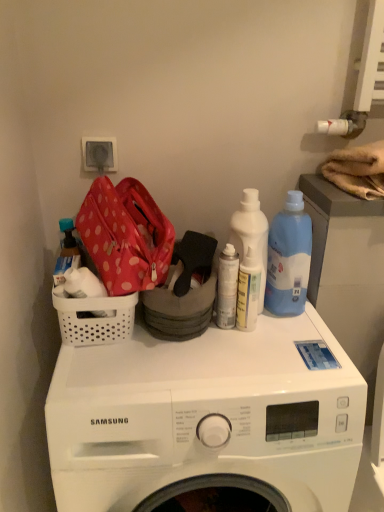
Question: Would you say translucent plastic bottle at left, the second bottle when ordered from right to left, is outside translucent plastic spray bottle at center, which is counted as the 1th cleaning product, starting from the left?

Choices:
 (A) no
 (B) yes

Answer: (B)

Question: Is translucent plastic spray bottle at center, which is counted as the 1th cleaning product, starting from the left, inside translucent plastic bottle at left, the second bottle when ordered from right to left?

Choices:
 (A) no
 (B) yes

Answer: (A)

Question: Is translucent plastic bottle at left, the second bottle when ordered from right to left, positioned far away from translucent plastic spray bottle at center, which is counted as the 1th cleaning product, starting from the left?

Choices:
 (A) no
 (B) yes

Answer: (A)

Question: Is translucent plastic bottle at left, the second bottle when ordered from right to left, positioned in front of translucent plastic spray bottle at center, which is counted as the third cleaning product, starting from the right?

Choices:
 (A) yes
 (B) no

Answer: (B)

Question: Considering the relative sizes of translucent plastic bottle at left, the 1th bottle positioned from the left, and translucent plastic spray bottle at center, which is counted as the 1th cleaning product, starting from the left, in the image provided, is translucent plastic bottle at left, the 1th bottle positioned from the left, bigger than translucent plastic spray bottle at center, which is counted as the 1th cleaning product, starting from the left,?

Choices:
 (A) no
 (B) yes

Answer: (B)

Question: Is white plastic electric outlet at upper left in front of or behind white plastic basket at left in the image?

Choices:
 (A) front
 (B) behind

Answer: (B)

Question: Considering the positions of white plastic electric outlet at upper left and white plastic basket at left in the image, is white plastic electric outlet at upper left taller or shorter than white plastic basket at left?

Choices:
 (A) tall
 (B) short

Answer: (B)

Question: From the image's perspective, is white plastic electric outlet at upper left above or below white plastic basket at left?

Choices:
 (A) above
 (B) below

Answer: (A)

Question: Do you think white plastic electric outlet at upper left is within white plastic basket at left, or outside of it?

Choices:
 (A) inside
 (B) outside

Answer: (B)

Question: From a real-world perspective, is blue plastic bottle at upper right, acting as the 1th cleaning product starting from the right, above or below white plastic electric outlet at upper left?

Choices:
 (A) above
 (B) below

Answer: (B)

Question: Considering their positions, is blue plastic bottle at upper right, acting as the 1th cleaning product starting from the right, located in front of or behind white plastic electric outlet at upper left?

Choices:
 (A) behind
 (B) front

Answer: (B)

Question: Is blue plastic bottle at upper right, acting as the 1th cleaning product starting from the right, inside the boundaries of white plastic electric outlet at upper left, or outside?

Choices:
 (A) outside
 (B) inside

Answer: (A)

Question: Is blue plastic bottle at upper right, which appears as the 3th cleaning product when viewed from the left, to the left or to the right of white plastic electric outlet at upper left in the image?

Choices:
 (A) right
 (B) left

Answer: (A)

Question: From a real-world perspective, is translucent plastic bottle at left, the second bottle when ordered from right to left, positioned above or below white matte spray can at center, the 2th bottle viewed from the left?

Choices:
 (A) below
 (B) above

Answer: (B)

Question: Is translucent plastic bottle at left, the 1th bottle positioned from the left, taller or shorter than white matte spray can at center, the first bottle in the right-to-left sequence?

Choices:
 (A) short
 (B) tall

Answer: (A)